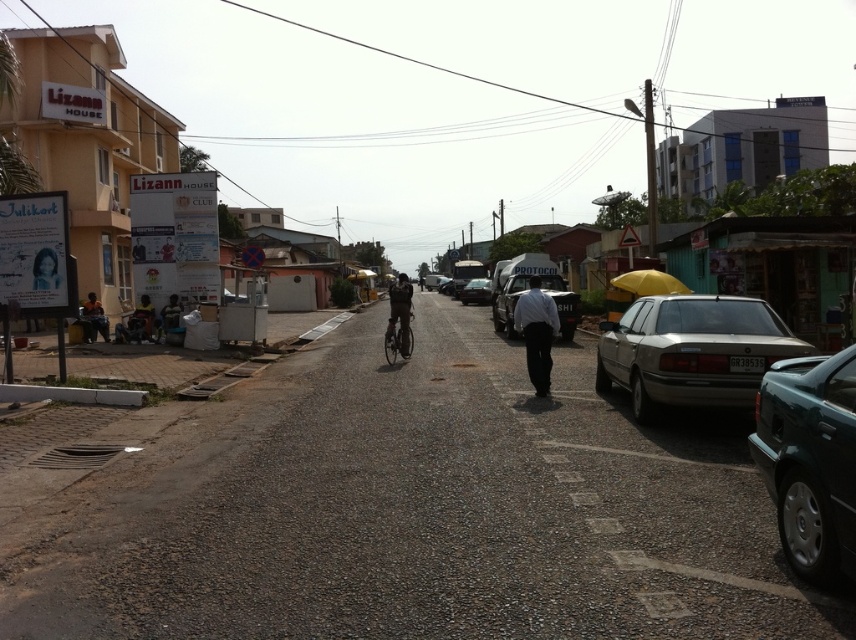
Question: Which object is farther from the camera taking this photo?

Choices:
 (A) dark green fabric bag at left
 (B) white shirt at center

Answer: (A)

Question: Is shiny metallic bicycle at center below metallic silver car at center?

Choices:
 (A) no
 (B) yes

Answer: (B)

Question: Does dark green fabric bag at left appear over dark brown leather jacket at lower left?

Choices:
 (A) no
 (B) yes

Answer: (A)

Question: Can you confirm if green metallic car at right is positioned below dark brown leather jacket at center?

Choices:
 (A) yes
 (B) no

Answer: (A)

Question: Which point is closer to the camera?

Choices:
 (A) (403, 285)
 (B) (681, 289)

Answer: (A)

Question: Which point is farther to the camera?

Choices:
 (A) (397, 346)
 (B) (813, 564)

Answer: (A)